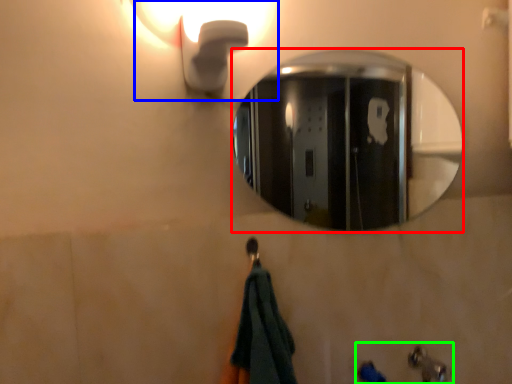
Question: Which object is the farthest from mirror (highlighted by a red box)? Choose among these: light fixture (highlighted by a blue box) or sink (highlighted by a green box).

Choices:
 (A) light fixture
 (B) sink

Answer: (B)